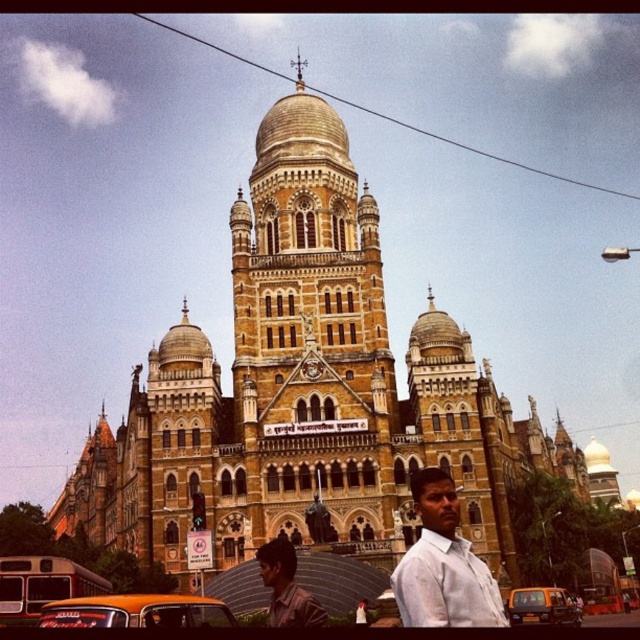
Is dark brown shirt at center closer to camera compared to orange matte taxi at lower center?

Yes, it is in front of orange matte taxi at lower center.

Is point (320, 612) closer to camera compared to point (554, 620)?

Yes, point (320, 612) is closer to viewer.

In order to click on dark brown shirt at center in this screenshot , I will do `click(285, 588)`.

Does yellow matte taxi at lower left lie in front of orange matte taxi at lower center?

Yes, it is in front of orange matte taxi at lower center.

Can you confirm if yellow matte taxi at lower left is positioned to the right of orange matte taxi at lower center?

Incorrect, yellow matte taxi at lower left is not on the right side of orange matte taxi at lower center.

Which is in front, point (61, 605) or point (560, 609)?

Point (61, 605)

Where is `yellow matte taxi at lower left`? This screenshot has height=640, width=640. yellow matte taxi at lower left is located at coordinates (136, 611).

Can you confirm if white cotton shirt at center is positioned to the right of yellow matte taxi at lower left?

Correct, you'll find white cotton shirt at center to the right of yellow matte taxi at lower left.

Who is more distant from viewer, (410, 592) or (170, 605)?

The point (170, 605) is more distant.

Locate an element on the screen. white cotton shirt at center is located at coordinates (442, 564).

Find the location of a particular element. Image resolution: width=640 pixels, height=640 pixels. white cotton shirt at center is located at coordinates (442, 564).